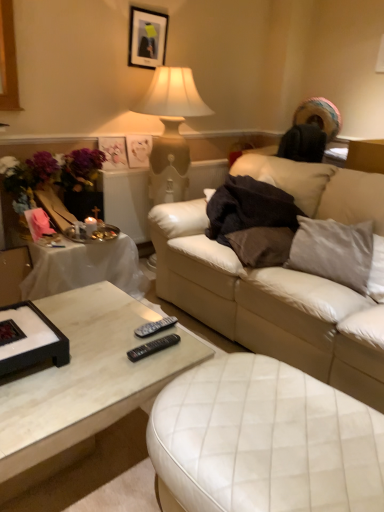
The width and height of the screenshot is (384, 512). Identify the location of vacant space to the right of black plastic remote at lower center, which is counted as the 1th remote, starting from the front. (182, 354).